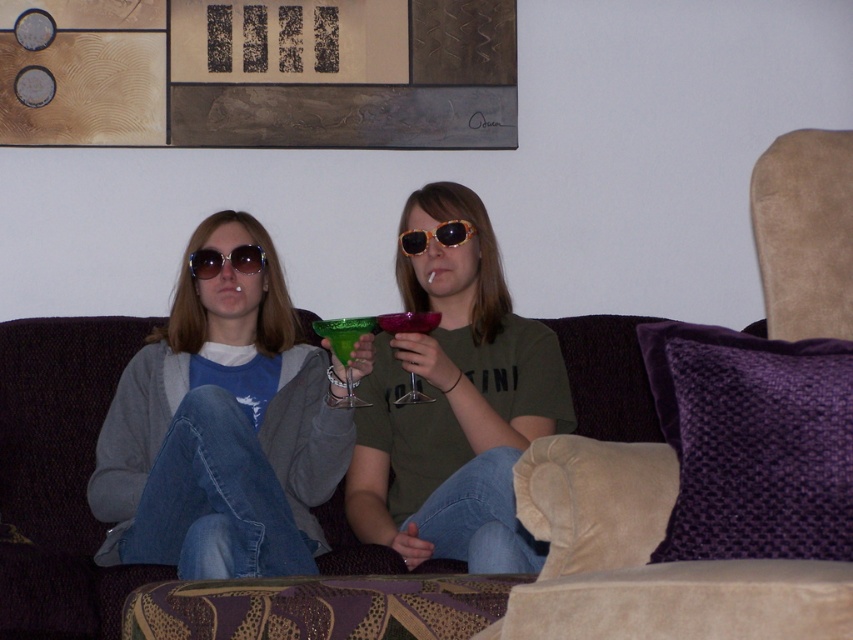
You are standing in the living room and want to place a small plant between the two points, point [296,500] and point [409,400]. To ensure the plant is placed correctly, which point should you consider as the back position?

Point [296,500] is behind point [409,400], so you should place the plant closer to point [296,500] to have it at the back position.

Looking at this image, you are planning to host a small gathering and need to seat 3 guests. You have a purple fabric couch at center and a suede armchair at right available. Can both furniture pieces accommodate all guests comfortably?

The purple fabric couch at center is bigger than the suede armchair at right, so together they can accommodate 3 guests comfortably.